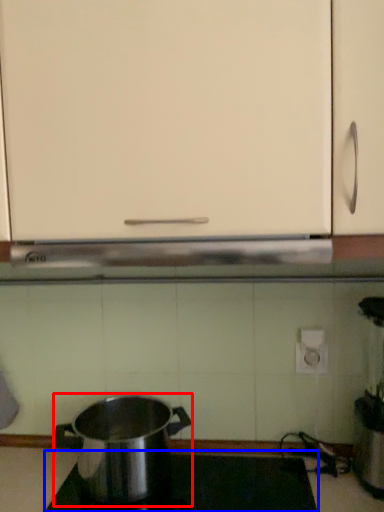
Question: Which object is closer to the camera taking this photo, kitchen appliance (highlighted by a red box) or gas stove (highlighted by a blue box)?

Choices:
 (A) kitchen appliance
 (B) gas stove

Answer: (B)